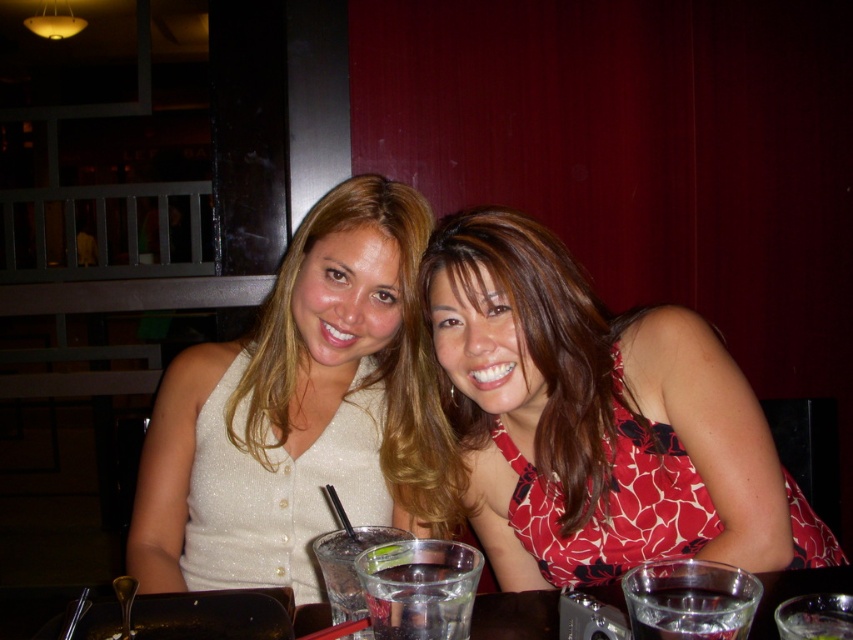
Is white glittery top at center in front of clear glass water at lower center?

No, white glittery top at center is behind clear glass water at lower center.

Does white glittery top at center have a greater width compared to clear glass water at lower center?

Yes.

In order to click on white glittery top at center in this screenshot , I will do click(299, 410).

Locate an element on the screen. This screenshot has width=853, height=640. white glittery top at center is located at coordinates (299, 410).

Which is above, white glittery top at center or red floral dress at center?

Positioned higher is white glittery top at center.

Image resolution: width=853 pixels, height=640 pixels. What do you see at coordinates (299, 410) in the screenshot? I see `white glittery top at center` at bounding box center [299, 410].

Who is more distant from viewer, (381, 240) or (695, 508)?

The point (381, 240) is more distant.

Locate an element on the screen. This screenshot has width=853, height=640. white glittery top at center is located at coordinates (299, 410).

Does white glittery top at center appear over matte white blouse at center?

No.

Does point (178, 422) come closer to viewer compared to point (416, 269)?

No, it is behind (416, 269).

Find the location of a particular element. This screenshot has height=640, width=853. white glittery top at center is located at coordinates (299, 410).